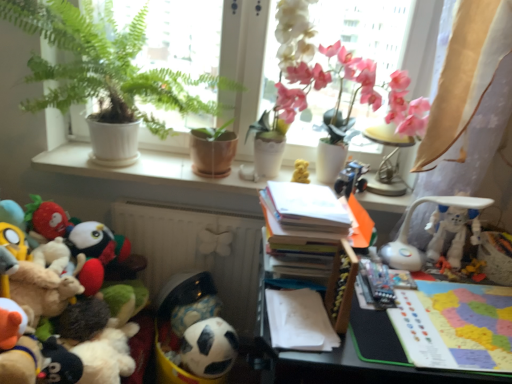
Question: Can you confirm if pink silk orchid at upper right is positioned to the right of white plastic robot at right, which is the sixth toy from left to right?

Choices:
 (A) no
 (B) yes

Answer: (A)

Question: From a real-world perspective, is pink silk orchid at upper right under white plastic robot at right, which appears as the first toy when viewed from the right?

Choices:
 (A) no
 (B) yes

Answer: (A)

Question: Can white plastic robot at right, which is the sixth toy from left to right, be found inside pink silk orchid at upper right?

Choices:
 (A) no
 (B) yes

Answer: (A)

Question: Considering the relative sizes of pink silk orchid at upper right and white plastic robot at right, which is the sixth toy from left to right, in the image provided, is pink silk orchid at upper right smaller than white plastic robot at right, which is the sixth toy from left to right,?

Choices:
 (A) yes
 (B) no

Answer: (B)

Question: Is the position of pink silk orchid at upper right less distant than that of white plastic robot at right, which appears as the first toy when viewed from the right?

Choices:
 (A) no
 (B) yes

Answer: (A)

Question: Is white ceramic pots at upper center inside the boundaries of white paper book at center, the first book from the left, or outside?

Choices:
 (A) inside
 (B) outside

Answer: (B)

Question: From the image's perspective, relative to white paper book at center, the first book from the left, is white ceramic pots at upper center above or below?

Choices:
 (A) above
 (B) below

Answer: (A)

Question: From a real-world perspective, is white ceramic pots at upper center physically located above or below white paper book at center, arranged as the 1th book when viewed from the top?

Choices:
 (A) below
 (B) above

Answer: (A)

Question: In terms of height, does white ceramic pots at upper center look taller or shorter compared to white paper book at center, which appears as the second book when ordered from the bottom?

Choices:
 (A) tall
 (B) short

Answer: (B)

Question: Based on their sizes in the image, would you say white ceramic pots at upper center is bigger or smaller than multicolored paper map at right, which appears as the 1th book when viewed from the right?

Choices:
 (A) big
 (B) small

Answer: (A)

Question: Is white ceramic pots at upper center to the left or to the right of multicolored paper map at right, which is the first book in bottom-to-top order, in the image?

Choices:
 (A) right
 (B) left

Answer: (B)

Question: Choose the correct answer: Is white ceramic pots at upper center inside multicolored paper map at right, which appears as the 1th book when viewed from the right, or outside it?

Choices:
 (A) inside
 (B) outside

Answer: (B)

Question: Relative to multicolored paper map at right, the 2th book when ordered from left to right, is white ceramic pots at upper center in front or behind?

Choices:
 (A) behind
 (B) front

Answer: (A)

Question: Is point (170, 168) closer or farther from the camera than point (139, 339)?

Choices:
 (A) closer
 (B) farther

Answer: (B)

Question: Is white ceramic pots at upper center inside the boundaries of fluffy plush toys at left, which appears as the 6th toy when viewed from the right, or outside?

Choices:
 (A) inside
 (B) outside

Answer: (B)